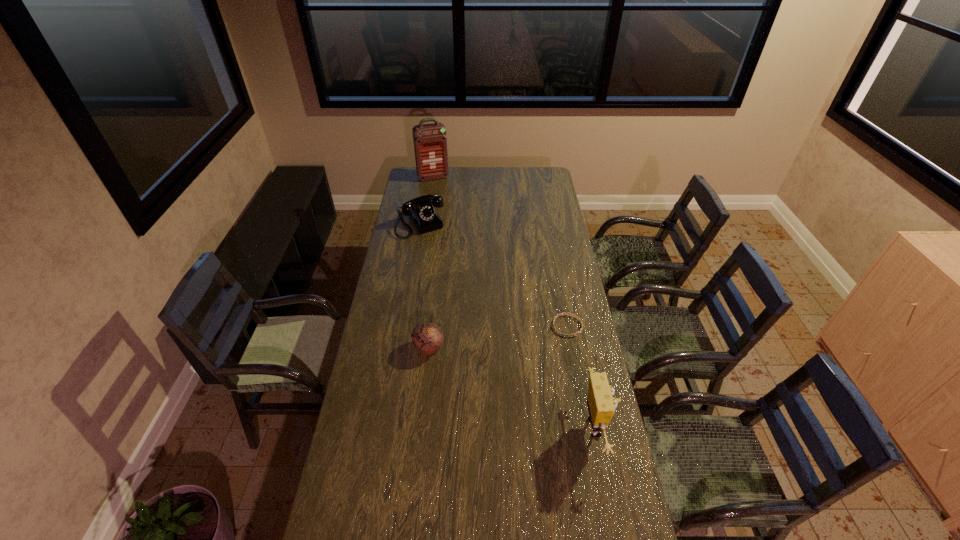
The image size is (960, 540). I want to click on free space located 0.320m on the dial of the third shortest object, so click(x=452, y=276).

Locate an element on the screen. The image size is (960, 540). vacant space located on the dial of the third shortest object is located at coordinates (460, 287).

The height and width of the screenshot is (540, 960). I want to click on vacant space situated on the front-facing side of the farthest object, so click(x=450, y=215).

You are a GUI agent. You are given a task and a screenshot of the screen. Output one action in this format:
    pyautogui.click(x=<x>, y=<y>)
    Task: Click on the vacant position located on the front-facing side of the farthest object
    Image resolution: width=960 pixels, height=540 pixels.
    Given the screenshot: What is the action you would take?
    pyautogui.click(x=439, y=186)

In order to click on vacant space located 0.360m on the front-facing side of the farthest object in this screenshot , I will do `click(450, 215)`.

Find the location of `vacant space located 0.280m on the surface of the shortest object showing star-shaped elements`. vacant space located 0.280m on the surface of the shortest object showing star-shaped elements is located at coordinates (505, 367).

The image size is (960, 540). Find the location of `vacant point located on the surface of the shortest object showing star-shaped elements`. vacant point located on the surface of the shortest object showing star-shaped elements is located at coordinates (494, 374).

Find the location of a particular element. This screenshot has width=960, height=540. vacant area situated on the surface of the shortest object showing star-shaped elements is located at coordinates (534, 348).

Locate an element on the screen. The image size is (960, 540). object at the far edge is located at coordinates (430, 142).

Locate an element on the screen. telephone that is positioned at the left edge is located at coordinates (420, 210).